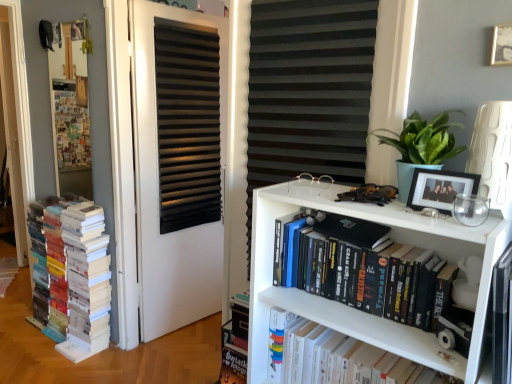
What are the coordinates of `vacant area that lies in front of multicolored paper books at left, arranged as the 3th book when viewed from the right` in the screenshot? It's located at (45, 363).